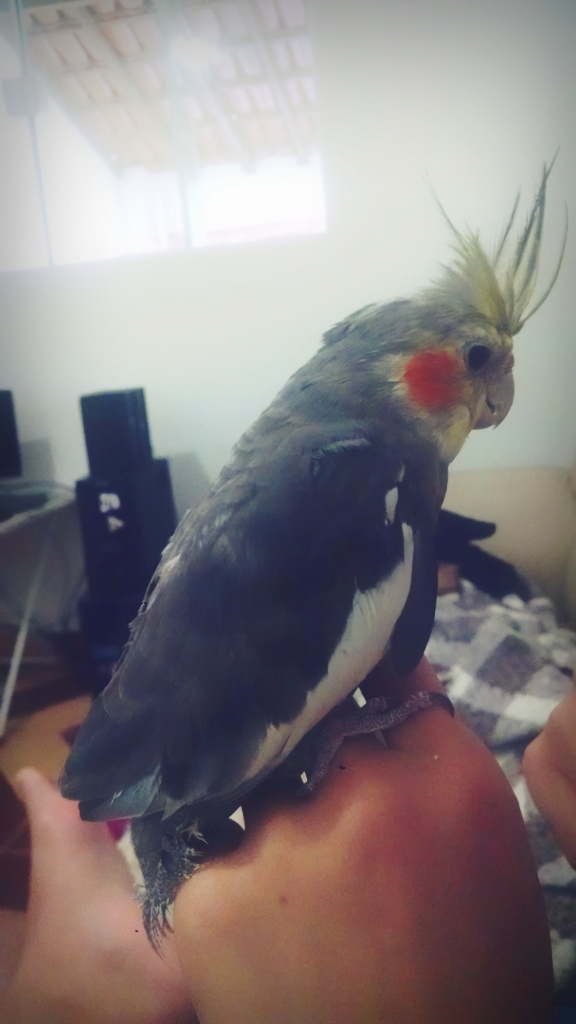
Locate an element on the screen. This screenshot has height=1024, width=576. desk is located at coordinates (56, 497).